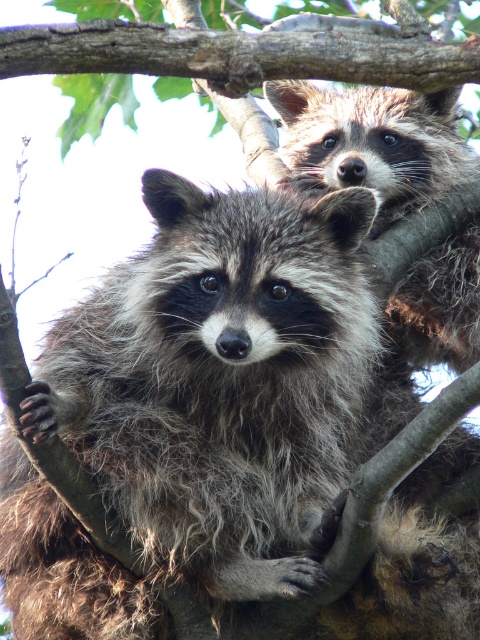
Question: Can you confirm if fuzzy brown raccoon at upper center is thinner than brown rough tree branch at upper center?

Choices:
 (A) no
 (B) yes

Answer: (B)

Question: Can you confirm if fuzzy brown raccoon at upper center is positioned below brown rough tree branch at upper center?

Choices:
 (A) yes
 (B) no

Answer: (A)

Question: Which point is closer to the camera?

Choices:
 (A) fuzzy brown raccoon at upper center
 (B) brown rough tree branch at upper center

Answer: (B)

Question: Which of the following is the closest to the observer?

Choices:
 (A) brown rough tree branch at upper center
 (B) fuzzy brown raccoon at upper center

Answer: (A)

Question: Is fuzzy brown raccoon at upper center below brown rough tree branch at upper center?

Choices:
 (A) no
 (B) yes

Answer: (B)